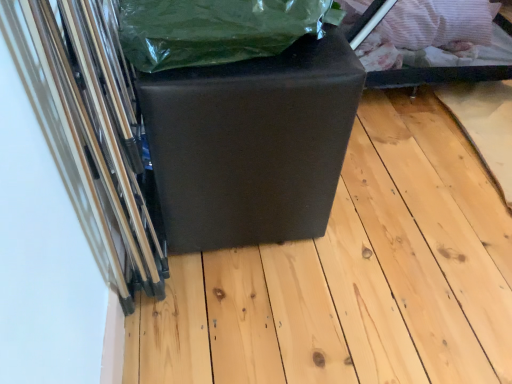
This screenshot has height=384, width=512. What do you see at coordinates (216, 30) in the screenshot? I see `green plastic bag at upper center` at bounding box center [216, 30].

Identify the location of matte black cube at center. (251, 143).

Image resolution: width=512 pixels, height=384 pixels. What are the coordinates of `matte black cube at center` in the screenshot? It's located at (353, 275).

From the image's perspective, which is below, matte black cube at center or matte black cube at center?

From the image's view, matte black cube at center is below.

Measure the distance from matte black cube at center to matte black cube at center.

matte black cube at center and matte black cube at center are 10.83 inches apart.

Which of these two, matte black cube at center or matte black cube at center, stands shorter?

matte black cube at center.

Which of these two, matte black cube at center or matte black cube at center, is smaller?

matte black cube at center.

Is matte black cube at center bigger or smaller than green plastic bag at upper center?

matte black cube at center is bigger than green plastic bag at upper center.

Find the location of `waste on the left of matte black cube at center`. waste on the left of matte black cube at center is located at coordinates pyautogui.click(x=216, y=30).

What's the angular difference between matte black cube at center and green plastic bag at upper center's facing directions?

matte black cube at center and green plastic bag at upper center are facing 92.2 degrees away from each other.

Is matte black cube at center not within green plastic bag at upper center?

matte black cube at center lies outside green plastic bag at upper center's area.

From the image's perspective, is green plastic bag at upper center below matte black cube at center?

No, from the image's perspective, green plastic bag at upper center is not below matte black cube at center.

Would you say green plastic bag at upper center contains matte black cube at center?

No, matte black cube at center is not a part of green plastic bag at upper center.

Is green plastic bag at upper center further to camera compared to matte black cube at center?

No, green plastic bag at upper center is closer to the camera.

From the picture: Considering the relative sizes of green plastic bag at upper center and matte black cube at center in the image provided, is green plastic bag at upper center thinner than matte black cube at center?

Yes.

Can you tell me how much matte black cube at center and matte black cube at center differ in facing direction?

89.8 degrees.

Who is bigger, matte black cube at center or matte black cube at center?

Bigger between the two is matte black cube at center.

Are matte black cube at center and matte black cube at center making contact?

matte black cube at center and matte black cube at center are clearly separated.

From the image's perspective, who appears lower, matte black cube at center or matte black cube at center?

matte black cube at center.

Which is behind, point (184, 70) or point (255, 0)?

The point (184, 70) is farther from the camera.

Which of these two, matte black cube at center or green plastic bag at upper center, stands shorter?

With less height is green plastic bag at upper center.

Does matte black cube at center have a greater width compared to green plastic bag at upper center?

Indeed, matte black cube at center has a greater width compared to green plastic bag at upper center.

Considering the relative positions of green plastic bag at upper center and matte black cube at center in the image provided, is green plastic bag at upper center to the left or to the right of matte black cube at center?

In the image, green plastic bag at upper center appears on the right side of matte black cube at center.

From a real-world perspective, which is physically above, green plastic bag at upper center or matte black cube at center?

green plastic bag at upper center.

Is green plastic bag at upper center situated inside matte black cube at center or outside?

green plastic bag at upper center is not inside matte black cube at center, it's outside.

Is green plastic bag at upper center oriented away from matte black cube at center?

That's not correct — green plastic bag at upper center is not looking away from matte black cube at center.

The image size is (512, 384). I want to click on furniture on the left of matte black cube at center, so click(251, 143).

At what (x,y) coordinates should I click in order to perform the action: click on wood below the green plastic bag at upper center (from a real-world perspective). Please return your answer as a coordinate pair (x, y). The width and height of the screenshot is (512, 384). Looking at the image, I should click on (353, 275).

Looking at the image, which one is located further to green plastic bag at upper center, matte black cube at center or matte black cube at center?

matte black cube at center is further to green plastic bag at upper center.

When comparing their distances from matte black cube at center, does matte black cube at center or green plastic bag at upper center seem closer?

Based on the image, matte black cube at center appears to be nearer to matte black cube at center.

Based on their spatial positions, is green plastic bag at upper center or matte black cube at center closer to matte black cube at center?

matte black cube at center is positioned closer to the anchor matte black cube at center.

Based on the photo, based on their spatial positions, is matte black cube at center or green plastic bag at upper center further from matte black cube at center?

matte black cube at center is further to matte black cube at center.

From the image, which object appears to be nearer to matte black cube at center, green plastic bag at upper center or matte black cube at center?

Based on the image, green plastic bag at upper center appears to be nearer to matte black cube at center.

In the scene shown: Which object lies nearer to the anchor point green plastic bag at upper center, matte black cube at center or matte black cube at center?

matte black cube at center is closer to green plastic bag at upper center.

This screenshot has width=512, height=384. Identify the location of waste located between matte black cube at center and matte black cube at center in the left-right direction. (216, 30).